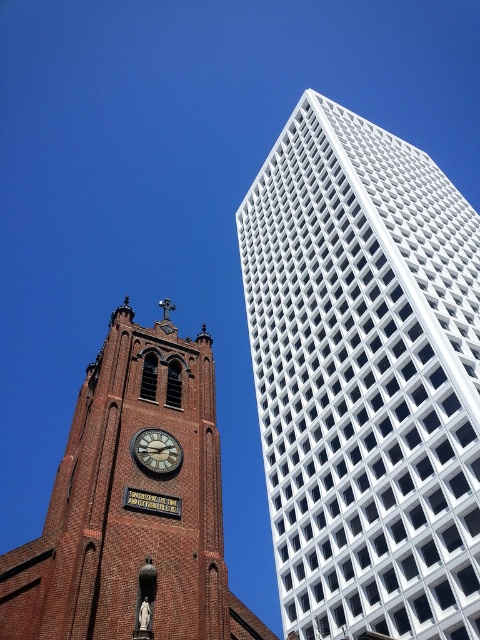
Question: Which point is closer to the camera?

Choices:
 (A) brick clock tower at lower left
 (B) gold-toned metal clock at center-left
 (C) white grid-patterned building at upper right

Answer: (A)

Question: Does white grid-patterned building at upper right lie behind brick clock tower at lower left?

Choices:
 (A) yes
 (B) no

Answer: (A)

Question: Can you confirm if white grid-patterned building at upper right is thinner than gold-toned metal clock at center-left?

Choices:
 (A) yes
 (B) no

Answer: (B)

Question: Which is farther from the brick clock tower at lower left?

Choices:
 (A) white grid-patterned building at upper right
 (B) gold-toned metal clock at center-left

Answer: (A)

Question: Estimate the real-world distances between objects in this image. Which object is farther from the brick clock tower at lower left?

Choices:
 (A) gold-toned metal clock at center-left
 (B) white grid-patterned building at upper right

Answer: (B)

Question: Is white grid-patterned building at upper right positioned at the back of gold-toned metal clock at center-left?

Choices:
 (A) no
 (B) yes

Answer: (B)